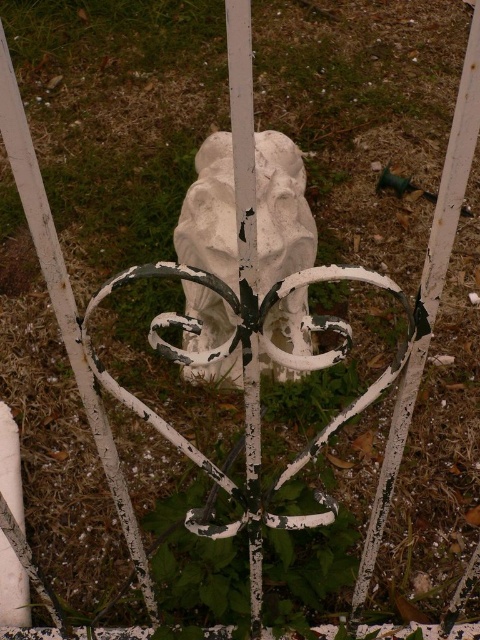
You are an architect designing a new garden layout. You need to place a small bench between the white matte stone lion at center and the white painted metal pole at center. Based on their widths, which object should the bench be closer to?

The bench should be closer to the white painted metal pole at center because the white matte stone lion at center might be wider, requiring more space between them.

You are a painter hired to paint the white matte stone lion at center and the white painted metal pole at center. Which object requires more paint to cover its entire surface area?

The white painted metal pole at center requires more paint to cover its entire surface area because it is taller than the white matte stone lion at center.